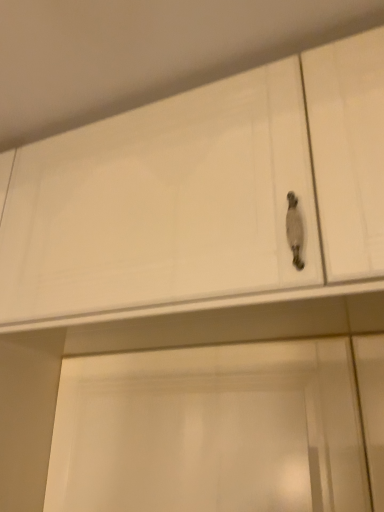
You are a GUI agent. You are given a task and a screenshot of the screen. Output one action in this format:
    pyautogui.click(x=<x>, y=<y>)
    Task: Click on the white glossy cabinet at upper center
    The height and width of the screenshot is (512, 384).
    Given the screenshot: What is the action you would take?
    pyautogui.click(x=162, y=203)

What do you see at coordinates (162, 203) in the screenshot? This screenshot has height=512, width=384. I see `white glossy cabinet at upper center` at bounding box center [162, 203].

Measure the distance between white glossy cabinet at upper center and camera.

white glossy cabinet at upper center and camera are 21.14 inches apart from each other.

This screenshot has width=384, height=512. Identify the location of white glossy cabinet at upper center. (162, 203).